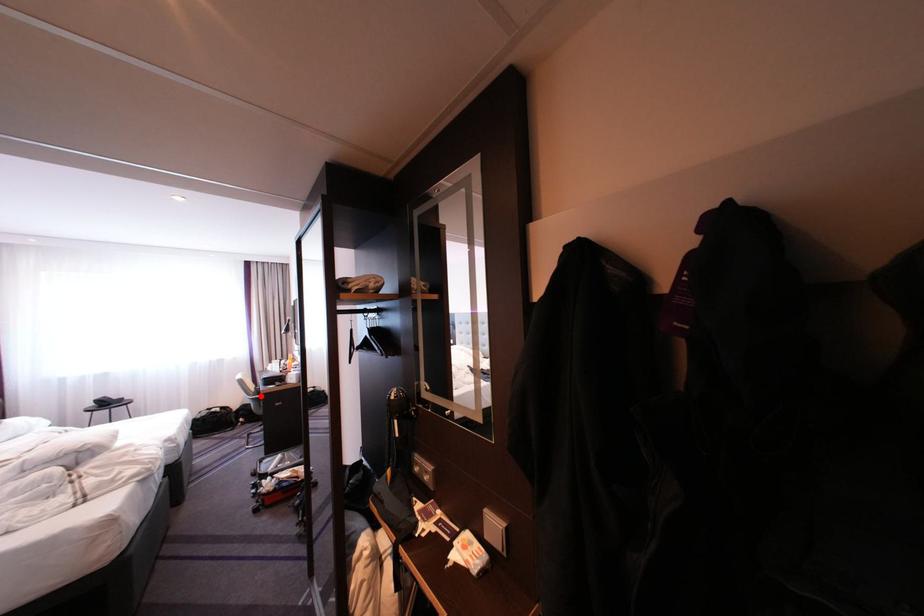
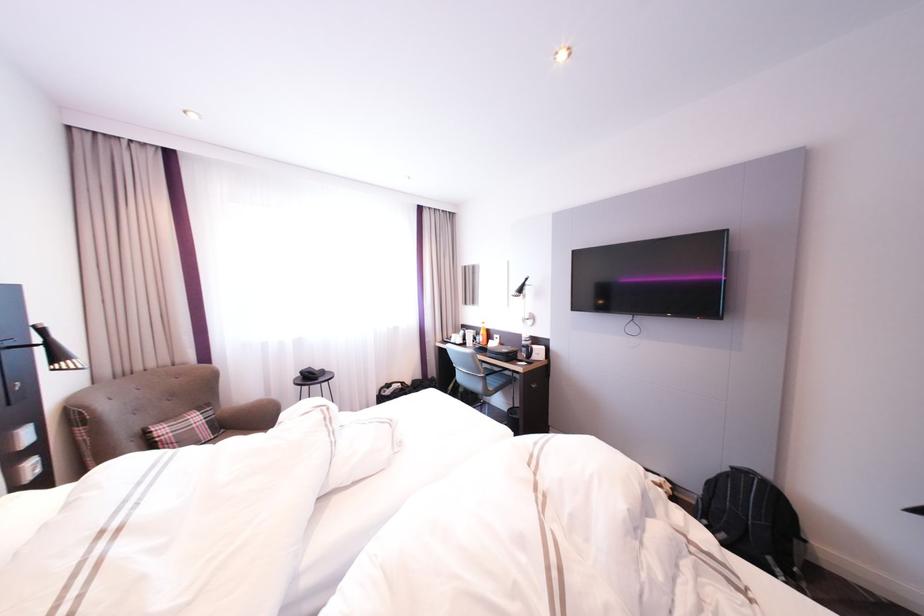
Question: I am providing you with two images of the same scene from different viewpoints. Given a red point in image1, look at the same physical point in image2. Is it:

Choices:
 (A) Closer to the viewpoint
 (B) Farther from the viewpoint

Answer: (A)